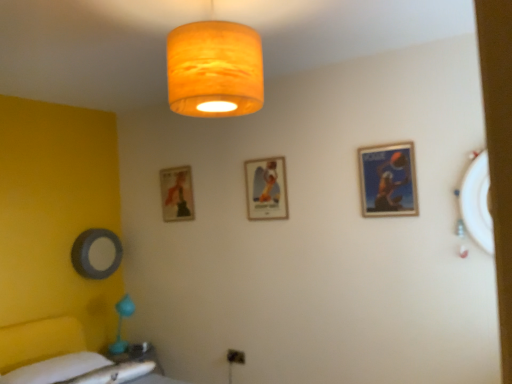
Question: Does matte white table at lower left have a smaller size compared to white fabric bedsheet at lower left?

Choices:
 (A) no
 (B) yes

Answer: (A)

Question: Would you say matte white table at lower left contains white fabric bedsheet at lower left?

Choices:
 (A) no
 (B) yes

Answer: (A)

Question: Could you tell me if matte white table at lower left is turned towards white fabric bedsheet at lower left?

Choices:
 (A) yes
 (B) no

Answer: (B)

Question: From the image's perspective, would you say matte white table at lower left is positioned over white fabric bedsheet at lower left?

Choices:
 (A) no
 (B) yes

Answer: (A)

Question: Does matte white table at lower left have a lesser height compared to white fabric bedsheet at lower left?

Choices:
 (A) no
 (B) yes

Answer: (A)

Question: Is matte white table at lower left bigger than white fabric bedsheet at lower left?

Choices:
 (A) yes
 (B) no

Answer: (A)

Question: Considering the relative sizes of matte white table at lower left and matte orange fabric lampshade at upper center in the image provided, is matte white table at lower left taller than matte orange fabric lampshade at upper center?

Choices:
 (A) yes
 (B) no

Answer: (B)

Question: Is matte white table at lower left at the right side of matte orange fabric lampshade at upper center?

Choices:
 (A) no
 (B) yes

Answer: (A)

Question: Considering the relative positions of matte white table at lower left and matte orange fabric lampshade at upper center in the image provided, is matte white table at lower left to the left of matte orange fabric lampshade at upper center from the viewer's perspective?

Choices:
 (A) no
 (B) yes

Answer: (B)

Question: Is the position of matte white table at lower left more distant than that of matte orange fabric lampshade at upper center?

Choices:
 (A) yes
 (B) no

Answer: (A)

Question: From the image's perspective, is matte white table at lower left above matte orange fabric lampshade at upper center?

Choices:
 (A) no
 (B) yes

Answer: (A)

Question: Is matte white table at lower left looking in the opposite direction of matte orange fabric lampshade at upper center?

Choices:
 (A) no
 (B) yes

Answer: (A)

Question: Considering the relative sizes of matte blue poster at upper right, acting as the third picture frame starting from the left, and white fabric bedsheet at lower left in the image provided, is matte blue poster at upper right, acting as the third picture frame starting from the left, smaller than white fabric bedsheet at lower left?

Choices:
 (A) yes
 (B) no

Answer: (A)